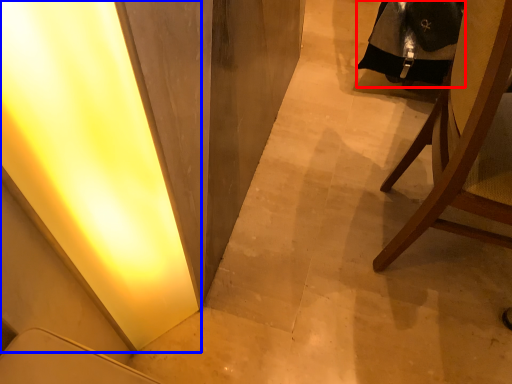
Question: Among these objects, which one is farthest to the camera, robe (highlighted by a red box) or light (highlighted by a blue box)?

Choices:
 (A) robe
 (B) light

Answer: (A)